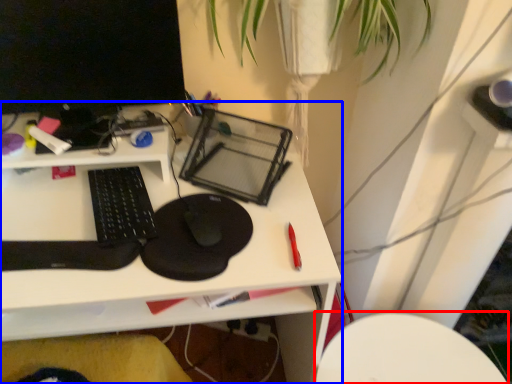
Question: Which object appears farthest to the camera in this image, computer chair (highlighted by a red box) or desk (highlighted by a blue box)?

Choices:
 (A) computer chair
 (B) desk

Answer: (A)